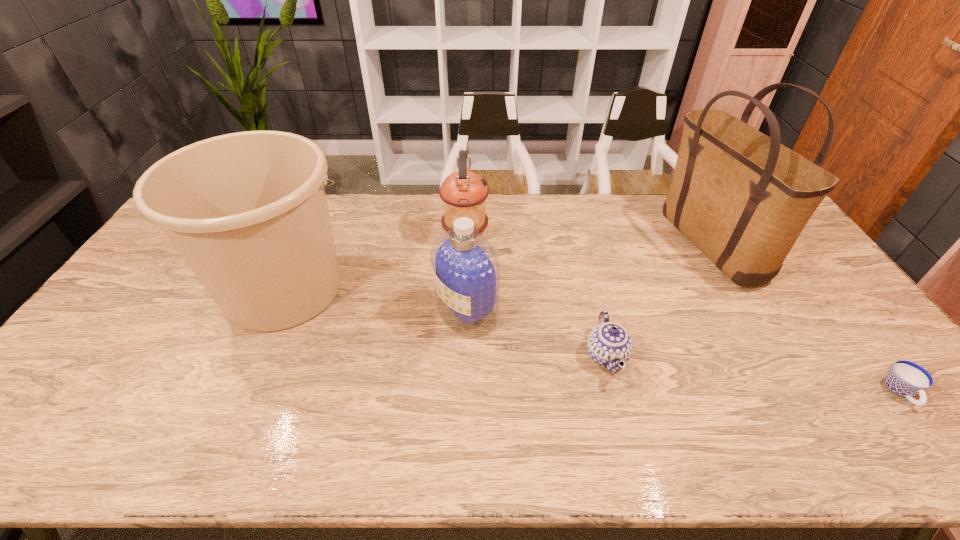
The height and width of the screenshot is (540, 960). I want to click on tote bag that is positioned at the right edge, so click(x=742, y=198).

You are a GUI agent. You are given a task and a screenshot of the screen. Output one action in this format:
    pyautogui.click(x=<x>, y=<y>)
    Task: Click on the cup that is at the right edge
    Image resolution: width=960 pixels, height=540 pixels.
    Given the screenshot: What is the action you would take?
    pyautogui.click(x=904, y=378)

This screenshot has width=960, height=540. Identify the location of object that is at the far right corner. (742, 198).

Locate an element on the screen. This screenshot has width=960, height=540. blank area at the far edge is located at coordinates (574, 219).

Image resolution: width=960 pixels, height=540 pixels. What are the coordinates of `vacant space at the near edge of the desktop` in the screenshot? It's located at (82, 437).

Identify the location of free space at the left edge of the desktop. (128, 359).

Where is `vacant space at the right edge of the desktop`? This screenshot has height=540, width=960. vacant space at the right edge of the desktop is located at coordinates (819, 321).

Identify the location of unoccupied position between the chinaware and the tallest object. The width and height of the screenshot is (960, 540). point(658,300).

The image size is (960, 540). In order to click on vacant area that lies between the third object from right to left and the fifth object from left to right in this screenshot , I will do `click(658, 300)`.

This screenshot has width=960, height=540. In order to click on free point between the fifth tallest object and the cleansing agent in this screenshot , I will do `click(537, 334)`.